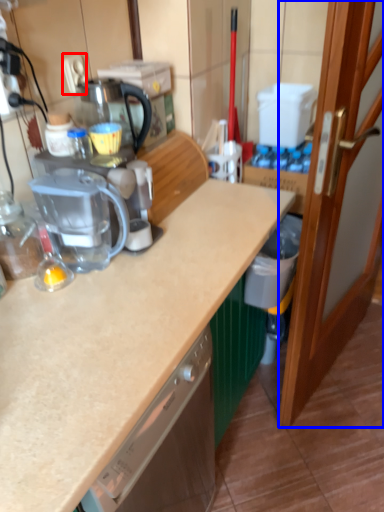
Question: Among these objects, which one is nearest to the camera, electric outlet (highlighted by a red box) or door (highlighted by a blue box)?

Choices:
 (A) electric outlet
 (B) door

Answer: (B)